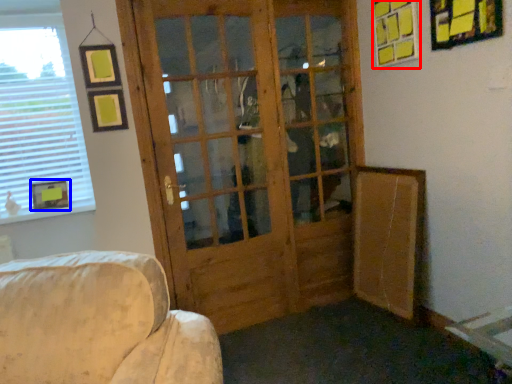
Question: Which object is further to the camera taking this photo, picture frame (highlighted by a red box) or picture frame (highlighted by a blue box)?

Choices:
 (A) picture frame
 (B) picture frame

Answer: (B)